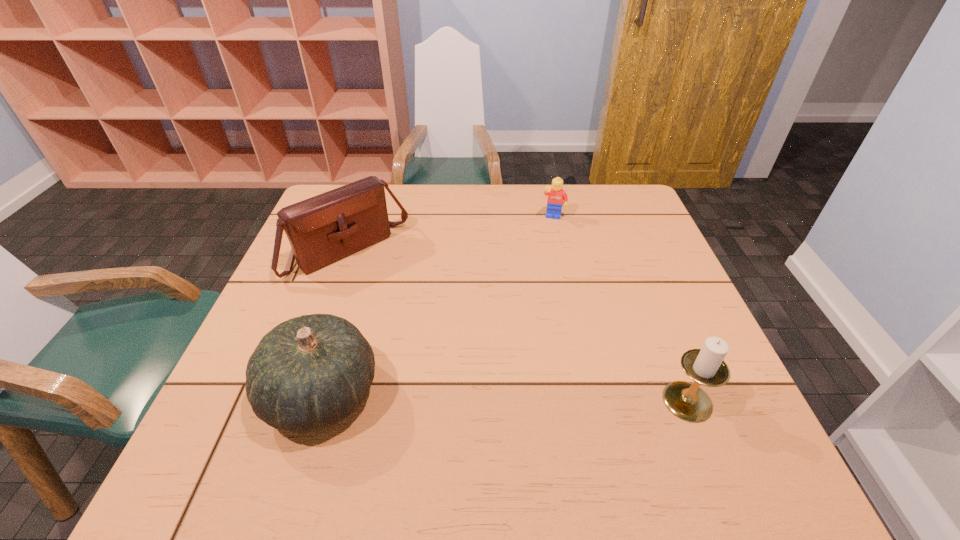
Identify the location of object at the far left corner. Image resolution: width=960 pixels, height=540 pixels. (323, 229).

The height and width of the screenshot is (540, 960). Identify the location of object that is at the near left corner. (308, 373).

Find the location of `object that is at the near right corner`. object that is at the near right corner is located at coordinates point(706,366).

This screenshot has height=540, width=960. What are the coordinates of `vacant space at the far edge` in the screenshot? It's located at (469, 188).

Image resolution: width=960 pixels, height=540 pixels. I want to click on vacant space at the near edge, so click(630, 394).

Where is `blank area at the right edge`? This screenshot has height=540, width=960. blank area at the right edge is located at coordinates (684, 330).

At what (x,y) coordinates should I click in order to perform the action: click on free space at the near left corner of the desktop. Please return your answer as a coordinate pair (x, y). The width and height of the screenshot is (960, 540). Looking at the image, I should click on (243, 405).

The width and height of the screenshot is (960, 540). What are the coordinates of `free spot between the rightmost object and the second object from right to left` in the screenshot? It's located at (620, 309).

The height and width of the screenshot is (540, 960). What are the coordinates of `empty space that is in between the shoulder bag and the farthest object` in the screenshot? It's located at (451, 235).

Where is `free point between the farthest object and the candle holder`? free point between the farthest object and the candle holder is located at coordinates click(620, 309).